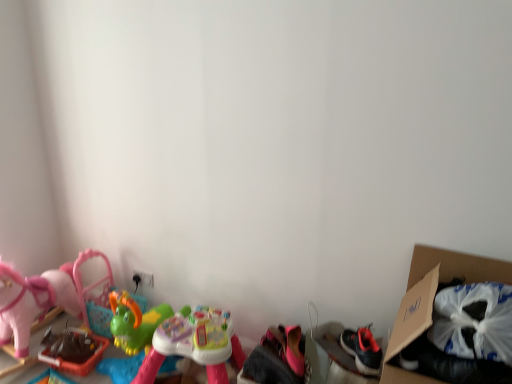
Question: Considering the relative sizes of cardboard box at right and pink fabric shoes at lower center, arranged as the 3th toy when viewed from the left, in the image provided, is cardboard box at right wider than pink fabric shoes at lower center, arranged as the 3th toy when viewed from the left,?

Choices:
 (A) yes
 (B) no

Answer: (A)

Question: Would you say cardboard box at right contains pink fabric shoes at lower center, acting as the 1th toy starting from the right?

Choices:
 (A) no
 (B) yes

Answer: (A)

Question: Considering the relative sizes of cardboard box at right and pink fabric shoes at lower center, acting as the 1th toy starting from the right, in the image provided, is cardboard box at right thinner than pink fabric shoes at lower center, acting as the 1th toy starting from the right,?

Choices:
 (A) yes
 (B) no

Answer: (B)

Question: Does cardboard box at right have a smaller size compared to pink fabric shoes at lower center, acting as the 1th toy starting from the right?

Choices:
 (A) no
 (B) yes

Answer: (A)

Question: From the image's perspective, does cardboard box at right appear lower than pink fabric shoes at lower center, arranged as the 3th toy when viewed from the left?

Choices:
 (A) yes
 (B) no

Answer: (B)

Question: From the image's perspective, is pink fabric shoes at lower center, acting as the 1th toy starting from the right, positioned above or below multicolored plastic toy at center, the 2th toy when ordered from left to right?

Choices:
 (A) above
 (B) below

Answer: (B)

Question: Is pink fabric shoes at lower center, acting as the 1th toy starting from the right, wider or thinner than multicolored plastic toy at center, the second toy in the right-to-left sequence?

Choices:
 (A) wide
 (B) thin

Answer: (B)

Question: Is pink fabric shoes at lower center, arranged as the 3th toy when viewed from the left, taller or shorter than multicolored plastic toy at center, the second toy in the right-to-left sequence?

Choices:
 (A) tall
 (B) short

Answer: (A)

Question: In terms of size, does pink fabric shoes at lower center, arranged as the 3th toy when viewed from the left, appear bigger or smaller than multicolored plastic toy at center, the second toy in the right-to-left sequence?

Choices:
 (A) small
 (B) big

Answer: (A)

Question: From a real-world perspective, is rubberized green toy at lower left, the first toy positioned from the left, above or below cardboard box at right?

Choices:
 (A) above
 (B) below

Answer: (B)

Question: From their relative heights in the image, would you say rubberized green toy at lower left, the first toy positioned from the left, is taller or shorter than cardboard box at right?

Choices:
 (A) short
 (B) tall

Answer: (A)

Question: In terms of size, does rubberized green toy at lower left, which appears as the third toy when viewed from the right, appear bigger or smaller than cardboard box at right?

Choices:
 (A) small
 (B) big

Answer: (A)

Question: From the image's perspective, is rubberized green toy at lower left, the first toy positioned from the left, positioned above or below cardboard box at right?

Choices:
 (A) above
 (B) below

Answer: (B)

Question: Does point (457, 264) appear closer or farther from the camera than point (94, 360)?

Choices:
 (A) closer
 (B) farther

Answer: (A)

Question: From the image's perspective, relative to rubberized green toy at lower left, which appears as the third toy when viewed from the right, is cardboard box at right above or below?

Choices:
 (A) below
 (B) above

Answer: (B)